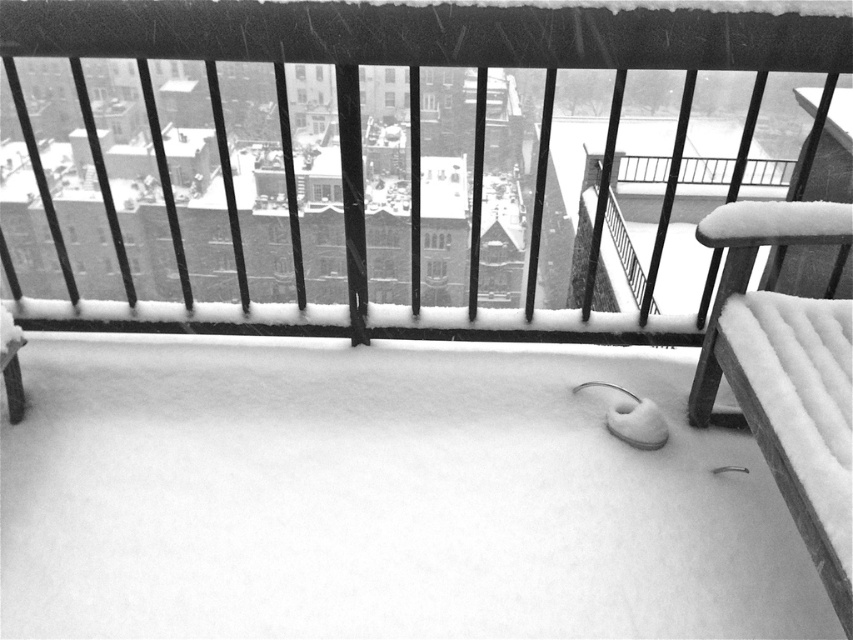
You are standing on the snowy balcony and want to reach both points marked on the image. Which point, point (384,44) or point (735,292), is closer to you?

Point (384,44) is closer to the viewer than point (735,292).